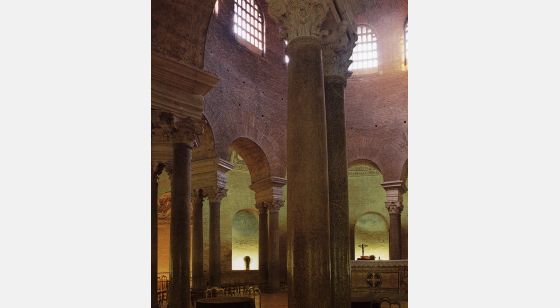
Where is `light`? Image resolution: width=560 pixels, height=308 pixels. light is located at coordinates (252, 262).